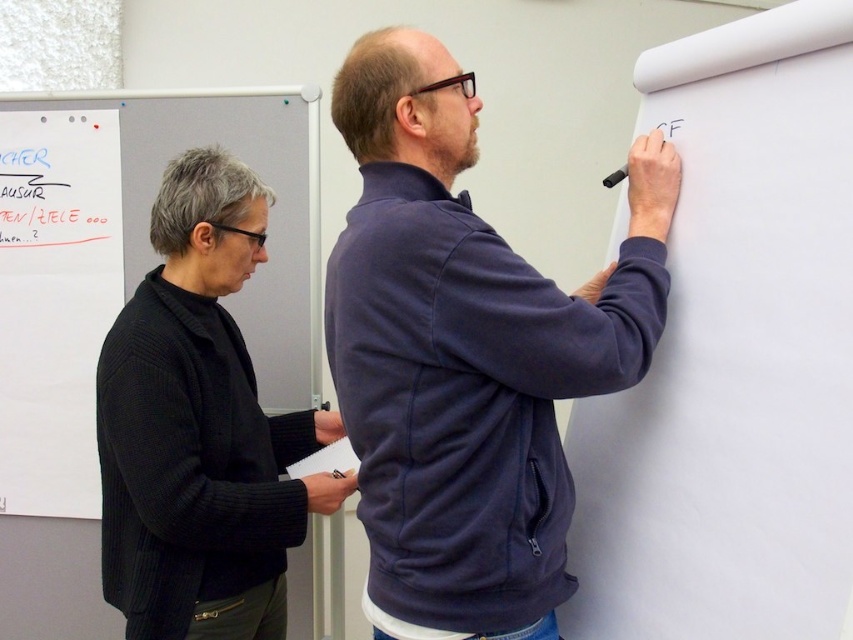
Does white matte bulletin board at upper left have a greater height compared to black matte pen at upper right?

Yes, white matte bulletin board at upper left is taller than black matte pen at upper right.

Does point (91, 184) come closer to viewer compared to point (663, 128)?

That is False.

Locate an element on the screen. The height and width of the screenshot is (640, 853). white matte bulletin board at upper left is located at coordinates (132, 262).

Can you confirm if white paperboard at right is bigger than black matte pen at upper right?

Yes.

Can you confirm if white paperboard at right is positioned above black matte pen at upper right?

Incorrect, white paperboard at right is not positioned above black matte pen at upper right.

Is point (740, 189) in front of point (614, 176)?

Yes, point (740, 189) is closer to viewer.

You are a GUI agent. You are given a task and a screenshot of the screen. Output one action in this format:
    pyautogui.click(x=<x>, y=<y>)
    Task: Click on the white paperboard at right
    Image resolution: width=853 pixels, height=640 pixels.
    Given the screenshot: What is the action you would take?
    pyautogui.click(x=734, y=356)

Who is positioned more to the right, white matte bulletin board at upper left or red marker writing at upper left?

From the viewer's perspective, white matte bulletin board at upper left appears more on the right side.

Looking at this image, measure the distance between point (61, 374) and camera.

They are 2.20 meters apart.

Where is `white matte bulletin board at upper left`? This screenshot has height=640, width=853. white matte bulletin board at upper left is located at coordinates (132, 262).